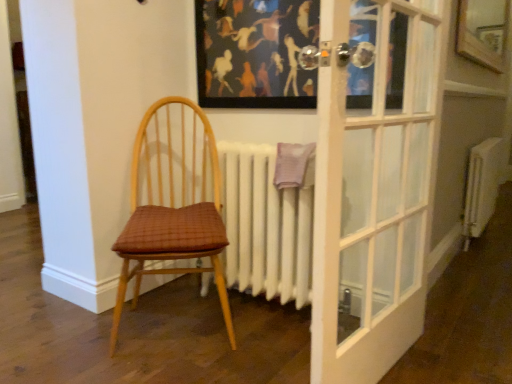
Locate an element on the screen. vacant region under wooden chair with woven seat cushion at left (from a real-world perspective) is located at coordinates (176, 323).